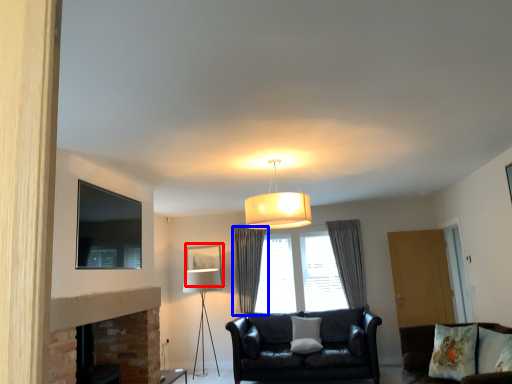
Question: Which object appears farthest to the camera in this image, picture frame (highlighted by a red box) or curtain (highlighted by a blue box)?

Choices:
 (A) picture frame
 (B) curtain

Answer: (A)